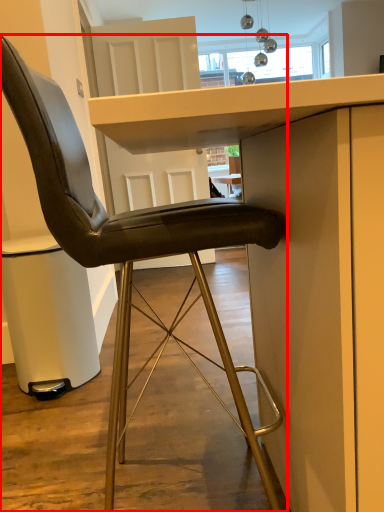
Question: From the image's perspective, considering the relative positions of chair (annotated by the red box) and table in the image provided, where is chair (annotated by the red box) located with respect to the staircase?

Choices:
 (A) below
 (B) above

Answer: (B)